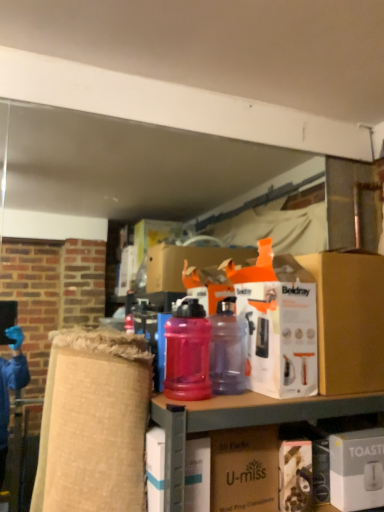
Identify the location of translucent plastic bottles at center. Image resolution: width=384 pixels, height=512 pixels. (239, 422).

Identify the location of translucent purple water bottle at center, the 2th bottle when ordered from left to right. Image resolution: width=384 pixels, height=512 pixels. (228, 349).

What do you see at coordinates (197, 475) in the screenshot?
I see `white cardboard box at center, which is the first box from left to right` at bounding box center [197, 475].

What is the approximate width of orange cardboard box at center, the 2th box when ordered from right to left?

The width of orange cardboard box at center, the 2th box when ordered from right to left, is 13.00 inches.

The height and width of the screenshot is (512, 384). Identify the location of orange cardboard box at center, the 2th box when ordered from right to left. (349, 320).

Measure the distance between matte brown cardboard box at center and camera.

matte brown cardboard box at center is 3.65 feet from camera.

Identify the location of translucent plastic bottles at center. (239, 422).

Find the location of a particular element. cardboard box in front of the translucent plastic water bottle at center, the 2th bottle when ordered from right to left is located at coordinates (244, 469).

Is matte brown cardboard box at center located outside translucent plastic water bottle at center, the 2th bottle when ordered from right to left?

matte brown cardboard box at center lies outside translucent plastic water bottle at center, the 2th bottle when ordered from right to left,'s area.

In the scene shown: Would you say matte brown cardboard box at center is to the left or to the right of translucent plastic water bottle at center, arranged as the 1th bottle when viewed from the left, in the picture?

Based on their positions, matte brown cardboard box at center is located to the right of translucent plastic water bottle at center, arranged as the 1th bottle when viewed from the left.

Is matte brown cardboard box at center far away from translucent plastic water bottle at center, the 2th bottle when ordered from right to left?

No, matte brown cardboard box at center is not far from translucent plastic water bottle at center, the 2th bottle when ordered from right to left.

Identify the location of the 2nd bottle below when counting from the orange cardboard box at center, the second box viewed from the left (from the image's perspective). Image resolution: width=384 pixels, height=512 pixels. (228, 349).

Which of these two, orange cardboard box at center, the 2th box when ordered from right to left, or translucent purple water bottle at center, placed as the 1th bottle when sorted from right to left, is smaller?

translucent purple water bottle at center, placed as the 1th bottle when sorted from right to left, is smaller.

Is orange cardboard box at center, the 2th box when ordered from right to left, spatially inside translucent purple water bottle at center, placed as the 1th bottle when sorted from right to left, or outside of it?

orange cardboard box at center, the 2th box when ordered from right to left, exists outside the volume of translucent purple water bottle at center, placed as the 1th bottle when sorted from right to left.

What's the angular difference between orange cardboard box at center, the 2th box when ordered from right to left, and translucent purple water bottle at center, the 2th bottle when ordered from left to right,'s facing directions?

There is a 0.601-degree angle between the facing directions of orange cardboard box at center, the 2th box when ordered from right to left, and translucent purple water bottle at center, the 2th bottle when ordered from left to right.

Is translucent purple water bottle at center, the 2th bottle when ordered from left to right, bigger than matte brown cardboard box at center?

Actually, translucent purple water bottle at center, the 2th bottle when ordered from left to right, might be smaller than matte brown cardboard box at center.

Do you think translucent purple water bottle at center, the 2th bottle when ordered from left to right, is within matte brown cardboard box at center, or outside of it?

translucent purple water bottle at center, the 2th bottle when ordered from left to right, is spatially situated outside matte brown cardboard box at center.

Is translucent purple water bottle at center, the 2th bottle when ordered from left to right, far from matte brown cardboard box at center?

No.

Based on the photo, are orange cardboard box at center, the 2th box when ordered from right to left, and translucent plastic water bottle at center, arranged as the 1th bottle when viewed from the left, making contact?

orange cardboard box at center, the 2th box when ordered from right to left, and translucent plastic water bottle at center, arranged as the 1th bottle when viewed from the left, are not in contact.

Which is more to the left, orange cardboard box at center, the 2th box when ordered from right to left, or translucent plastic water bottle at center, arranged as the 1th bottle when viewed from the left?

Positioned to the left is translucent plastic water bottle at center, arranged as the 1th bottle when viewed from the left.

From a real-world perspective, is orange cardboard box at center, the 2th box when ordered from right to left, physically above translucent plastic water bottle at center, arranged as the 1th bottle when viewed from the left?

Yes, from a real-world perspective, orange cardboard box at center, the 2th box when ordered from right to left, is above translucent plastic water bottle at center, arranged as the 1th bottle when viewed from the left.

Looking at this image, is orange cardboard box at center, the second box viewed from the left, outside of translucent plastic water bottle at center, arranged as the 1th bottle when viewed from the left?

That's correct, orange cardboard box at center, the second box viewed from the left, is outside of translucent plastic water bottle at center, arranged as the 1th bottle when viewed from the left.

Considering the points (337, 480) and (190, 330), which point is in front, point (337, 480) or point (190, 330)?

The point (190, 330) is more forward.

Are white matte toaster at lower right, the third box positioned from the left, and translucent plastic water bottle at center, the 2th bottle when ordered from right to left, far apart?

No, white matte toaster at lower right, the third box positioned from the left, is in close proximity to translucent plastic water bottle at center, the 2th bottle when ordered from right to left.

Is white matte toaster at lower right, which is the first box from right to left, spatially inside translucent plastic water bottle at center, the 2th bottle when ordered from right to left, or outside of it?

white matte toaster at lower right, which is the first box from right to left, is located beyond the bounds of translucent plastic water bottle at center, the 2th bottle when ordered from right to left.

Which is behind, white matte toaster at lower right, the third box positioned from the left, or translucent plastic water bottle at center, arranged as the 1th bottle when viewed from the left?

white matte toaster at lower right, the third box positioned from the left, is further away from the camera.

Is the position of orange cardboard box at center, the 2th box when ordered from right to left, more distant than that of white cardboard box at center, which is the first box from left to right?

Yes, it is.

Considering the relative sizes of orange cardboard box at center, the second box viewed from the left, and white cardboard box at center, which is the first box from left to right, in the image provided, is orange cardboard box at center, the second box viewed from the left, smaller than white cardboard box at center, which is the first box from left to right,?

No, orange cardboard box at center, the second box viewed from the left, is not smaller than white cardboard box at center, which is the first box from left to right.

Does orange cardboard box at center, the 2th box when ordered from right to left, appear on the left side of white cardboard box at center, which is the first box from left to right?

Incorrect, orange cardboard box at center, the 2th box when ordered from right to left, is not on the left side of white cardboard box at center, which is the first box from left to right.

How many degrees apart are the facing directions of translucent purple water bottle at center, placed as the 1th bottle when sorted from right to left, and white matte toaster at lower right, which is the first box from right to left?

translucent purple water bottle at center, placed as the 1th bottle when sorted from right to left, and white matte toaster at lower right, which is the first box from right to left, are facing 1.33 degrees away from each other.

Which is nearer, (224, 307) or (359, 508)?

Point (359, 508)

Considering the relative positions of translucent purple water bottle at center, the 2th bottle when ordered from left to right, and white matte toaster at lower right, the third box positioned from the left, in the image provided, is translucent purple water bottle at center, the 2th bottle when ordered from left to right, to the right of white matte toaster at lower right, the third box positioned from the left, from the viewer's perspective?

No, translucent purple water bottle at center, the 2th bottle when ordered from left to right, is not to the right of white matte toaster at lower right, the third box positioned from the left.

From the image's perspective, is translucent purple water bottle at center, placed as the 1th bottle when sorted from right to left, located beneath white matte toaster at lower right, the third box positioned from the left?

No.

Where is `the 2nd bottle above the matte brown cardboard box at center (from the image's perspective)`? This screenshot has width=384, height=512. the 2nd bottle above the matte brown cardboard box at center (from the image's perspective) is located at coordinates (187, 353).

At what (x,y) coordinates should I click in order to perform the action: click on box above the translucent purple water bottle at center, the 2th bottle when ordered from left to right (from a real-world perspective). Please return your answer as a coordinate pair (x, y). This screenshot has height=512, width=384. Looking at the image, I should click on (349, 320).

Based on their spatial positions, is white cardboard box at center, arranged as the 3th box when viewed from the right, or translucent plastic bottles at center further from translucent purple water bottle at center, the 2th bottle when ordered from left to right?

white cardboard box at center, arranged as the 3th box when viewed from the right, is positioned further to the anchor translucent purple water bottle at center, the 2th bottle when ordered from left to right.

From the image, which object appears to be nearer to white cardboard box at center, arranged as the 3th box when viewed from the right, translucent plastic water bottle at center, the 2th bottle when ordered from right to left, or white matte toaster at lower right, the third box positioned from the left?

translucent plastic water bottle at center, the 2th bottle when ordered from right to left, is positioned closer to the anchor white cardboard box at center, arranged as the 3th box when viewed from the right.

Based on their spatial positions, is white cardboard box at center, which is the first box from left to right, or translucent plastic water bottle at center, arranged as the 1th bottle when viewed from the left, closer to white matte toaster at lower right, the third box positioned from the left?

Among the two, white cardboard box at center, which is the first box from left to right, is located nearer to white matte toaster at lower right, the third box positioned from the left.

Which object lies further to the anchor point translucent plastic water bottle at center, the 2th bottle when ordered from right to left, white matte toaster at lower right, which is the first box from right to left, or translucent purple water bottle at center, the 2th bottle when ordered from left to right?

The object further to translucent plastic water bottle at center, the 2th bottle when ordered from right to left, is white matte toaster at lower right, which is the first box from right to left.

From the image, which object appears to be nearer to matte brown cardboard box at center, white matte toaster at lower right, the third box positioned from the left, or translucent purple water bottle at center, the 2th bottle when ordered from left to right?

translucent purple water bottle at center, the 2th bottle when ordered from left to right.

Which object lies nearer to the anchor point translucent purple water bottle at center, placed as the 1th bottle when sorted from right to left, orange cardboard box at center, the second box viewed from the left, or matte brown cardboard box at center?

matte brown cardboard box at center lies closer to translucent purple water bottle at center, placed as the 1th bottle when sorted from right to left, than the other object.

Estimate the real-world distances between objects in this image. Which object is closer to translucent plastic bottles at center, matte brown cardboard box at center or translucent plastic water bottle at center, arranged as the 1th bottle when viewed from the left?

matte brown cardboard box at center lies closer to translucent plastic bottles at center than the other object.

Considering their positions, is orange cardboard box at center, the second box viewed from the left, positioned further to matte brown cardboard box at center than translucent plastic bottles at center?

The object further to matte brown cardboard box at center is orange cardboard box at center, the second box viewed from the left.

Find the location of a particular element. Image resolution: width=384 pixels, height=512 pixels. cardboard box between orange cardboard box at center, the 2th box when ordered from right to left, and translucent plastic bottles at center from top to bottom is located at coordinates (x=244, y=469).

Identify the location of bottle between translucent plastic water bottle at center, the 2th bottle when ordered from right to left, and white matte toaster at lower right, the third box positioned from the left. This screenshot has height=512, width=384. (228, 349).

In order to click on box between translucent purple water bottle at center, the 2th bottle when ordered from left to right, and matte brown cardboard box at center from top to bottom in this screenshot , I will do `click(197, 475)`.

Find the location of a particular element. The width and height of the screenshot is (384, 512). cabinetry located between white cardboard box at center, arranged as the 3th box when viewed from the right, and white matte toaster at lower right, the third box positioned from the left, in the left-right direction is located at coordinates (239, 422).